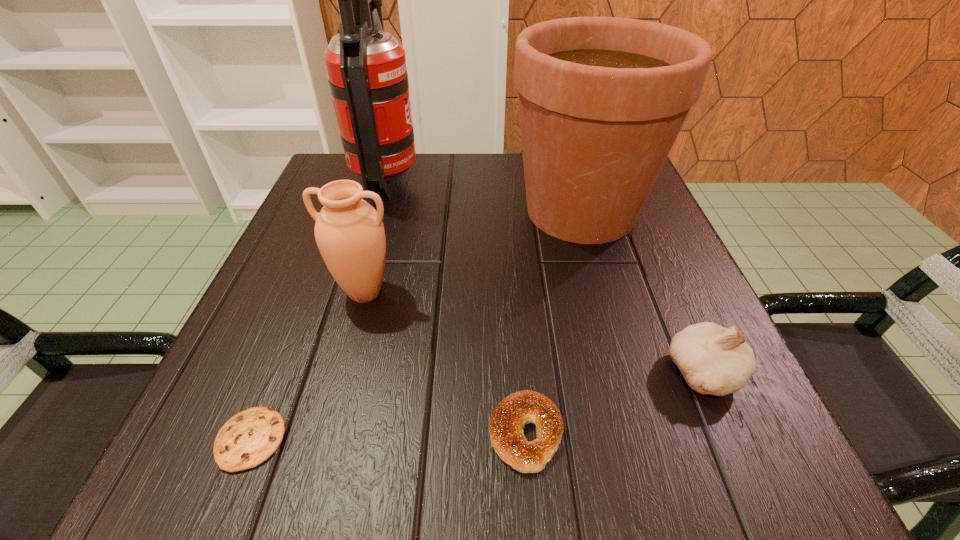
This screenshot has width=960, height=540. In the image, there is a desktop. What are the coordinates of `free space at the near right corner` in the screenshot? It's located at (780, 461).

Where is `free space between the third farthest object and the bagel`? The image size is (960, 540). free space between the third farthest object and the bagel is located at coordinates (445, 363).

Image resolution: width=960 pixels, height=540 pixels. Find the location of `free space between the second shortest object and the tallest object`. free space between the second shortest object and the tallest object is located at coordinates (456, 306).

You are a GUI agent. You are given a task and a screenshot of the screen. Output one action in this format:
    pyautogui.click(x=<x>, y=<y>)
    Task: Click on the unoccupied area between the fire extinguisher and the second tallest object
    The height and width of the screenshot is (540, 960).
    Given the screenshot: What is the action you would take?
    pyautogui.click(x=484, y=195)

Where is `free space between the tallest object and the cookie`? The image size is (960, 540). free space between the tallest object and the cookie is located at coordinates (319, 309).

At what (x,y) coordinates should I click in order to perform the action: click on empty space that is in between the shortest object and the urn. Please return your answer as a coordinate pair (x, y). The height and width of the screenshot is (540, 960). Looking at the image, I should click on (308, 366).

Where is `empty space between the garlic and the shortest object`? This screenshot has width=960, height=540. empty space between the garlic and the shortest object is located at coordinates (477, 406).

The height and width of the screenshot is (540, 960). I want to click on empty space between the fire extinguisher and the garlic, so click(x=545, y=275).

Image resolution: width=960 pixels, height=540 pixels. I want to click on blank region between the flowerpot and the fire extinguisher, so click(x=484, y=195).

Where is `unoccupied position between the tallest object and the second shortest object`? This screenshot has height=540, width=960. unoccupied position between the tallest object and the second shortest object is located at coordinates (456, 306).